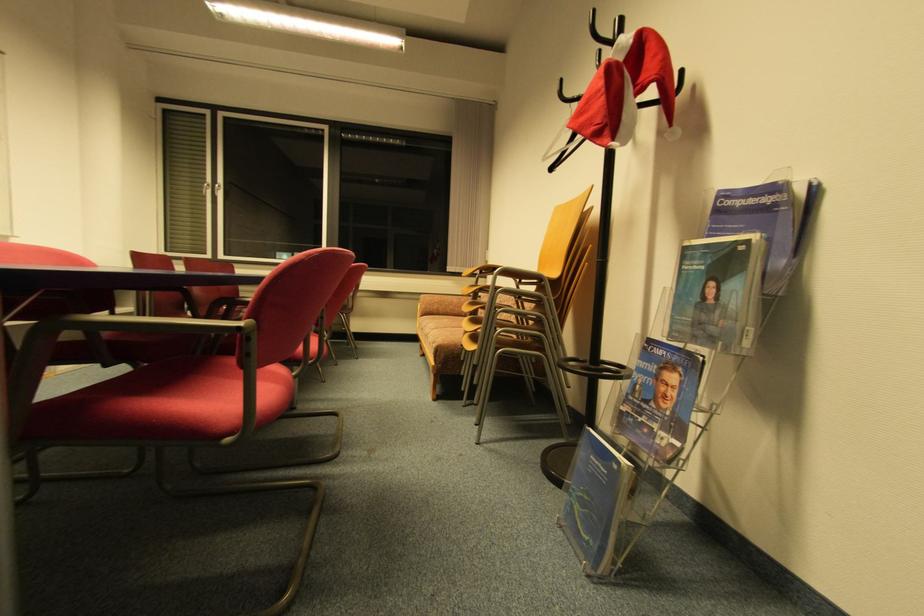
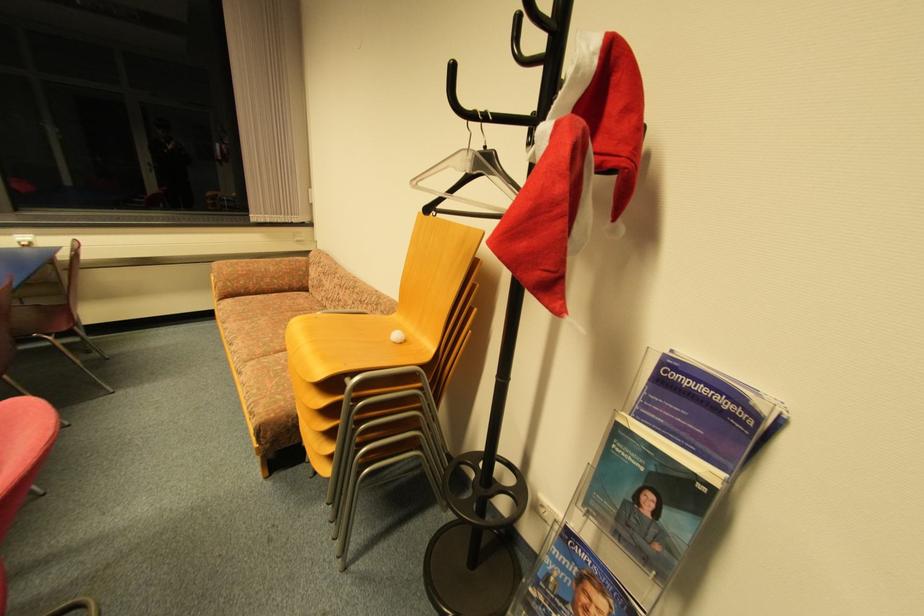
Where in the second image is the point corresponding to pixel 550 160 from the first image?

(419, 184)